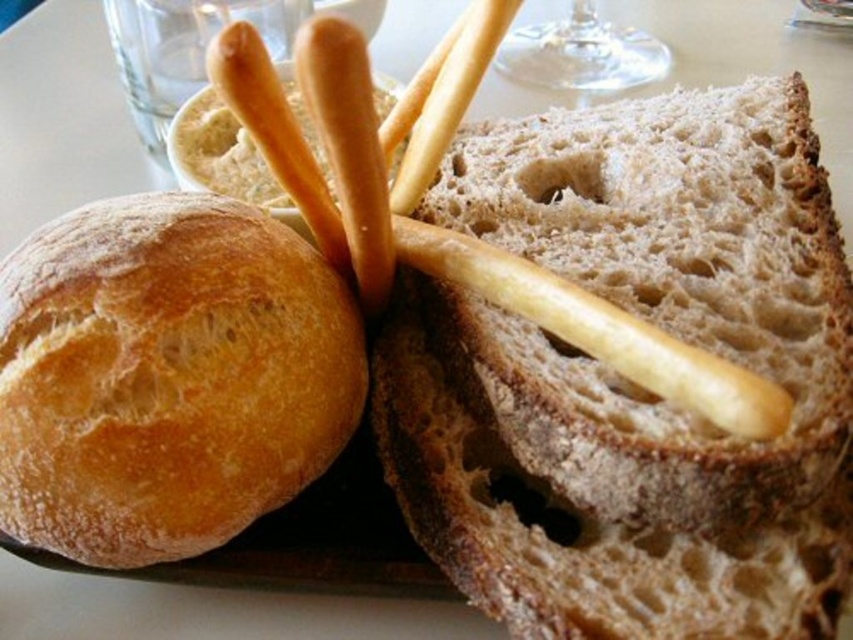
Question: Does golden brown crusty bread at left lie in front of transparent glass wine glass at upper center?

Choices:
 (A) no
 (B) yes

Answer: (B)

Question: Does brown crusty bread at center appear over golden brown crusty bread at left?

Choices:
 (A) yes
 (B) no

Answer: (A)

Question: Which object is closer to the camera taking this photo?

Choices:
 (A) transparent glass wine glass at upper center
 (B) golden brown crusty bread at left

Answer: (B)

Question: Where is golden brown crusty bread at left located in relation to transparent glass wine glass at upper center in the image?

Choices:
 (A) below
 (B) above

Answer: (A)

Question: Which object is positioned farthest from the golden brown crusty bread at left?

Choices:
 (A) brown crusty bread at center
 (B) transparent glass wine glass at upper center

Answer: (B)

Question: Which object is the farthest from the brown crusty bread at center?

Choices:
 (A) golden brown crusty bread at left
 (B) transparent glass wine glass at upper center

Answer: (B)